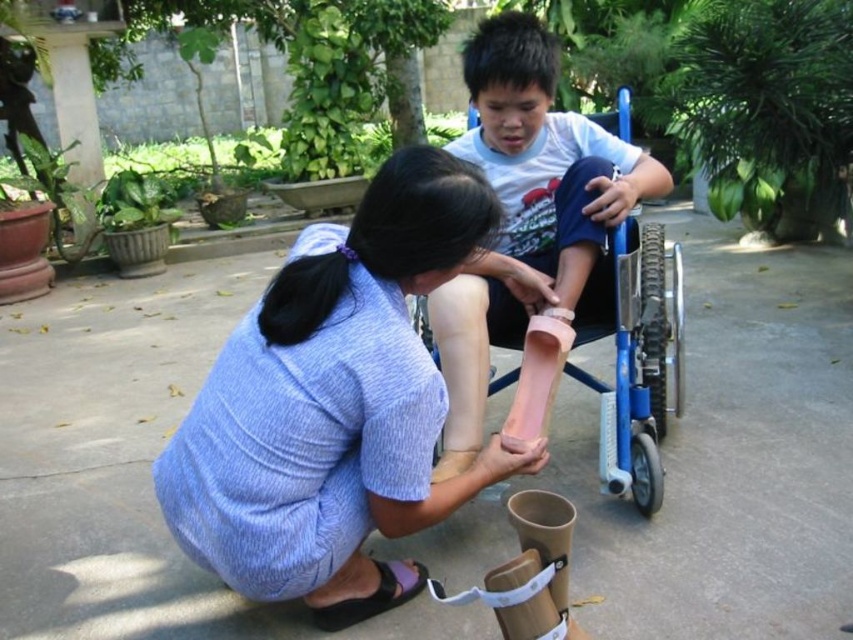
Who is shorter, matte blue dress at center or black fabric sandal at lower center?

Standing shorter between the two is black fabric sandal at lower center.

Can you confirm if matte blue dress at center is positioned above black fabric sandal at lower center?

Correct, matte blue dress at center is located above black fabric sandal at lower center.

Locate an element on the screen. matte blue dress at center is located at coordinates (334, 397).

Locate an element on the screen. The width and height of the screenshot is (853, 640). matte blue dress at center is located at coordinates (334, 397).

Between point (318, 516) and point (560, 182), which one is positioned in front?

Point (318, 516) is in front.

Does matte blue dress at center have a smaller size compared to pink matte prosthetic leg at center?

Indeed, matte blue dress at center has a smaller size compared to pink matte prosthetic leg at center.

Who is more distant from viewer, (416, 257) or (473, 346)?

Positioned behind is point (473, 346).

Identify the location of matte blue dress at center. (334, 397).

Can you confirm if pink matte prosthetic leg at center is positioned to the right of black fabric sandal at lower center?

Yes, pink matte prosthetic leg at center is to the right of black fabric sandal at lower center.

Can you confirm if pink matte prosthetic leg at center is smaller than black fabric sandal at lower center?

No, pink matte prosthetic leg at center is not smaller than black fabric sandal at lower center.

Is point (659, 195) positioned in front of point (399, 570)?

No, it is not.

What are the coordinates of `pink matte prosthetic leg at center` in the screenshot? It's located at (549, 164).